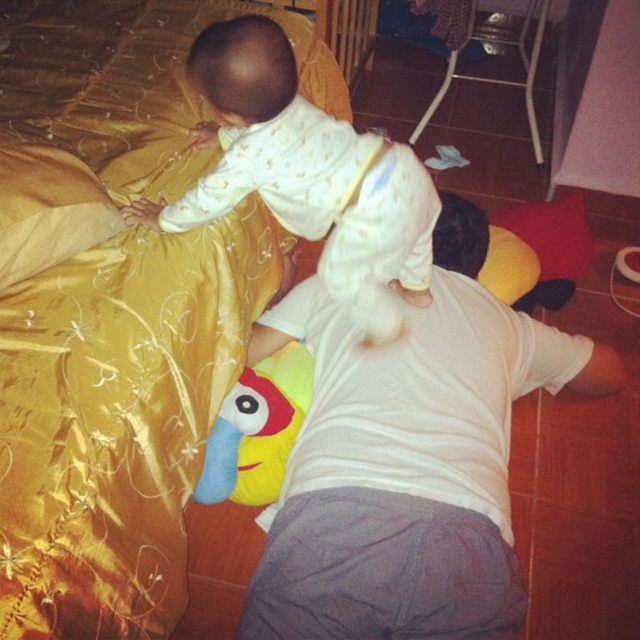
You are a photographer setting up a shot in this room. You want to place a small prop between the white soft onesie at upper center and the gold satin pillow at upper left. Based on their positions, which object should the prop be closer to?

The prop should be placed closer to the gold satin pillow at upper left because the white soft onesie at upper center is closer to the viewer, meaning the gold satin pillow at upper left is farther away. To position the prop between them, it needs to be closer to the farther object.

You are a photographer setting up a shoot in this room. You need to place a small lamp between the gold satin bed at upper left and the gold satin pillow at upper left. Based on their positions, which object should the lamp be closer to?

The gold satin bed at upper left is to the right of the gold satin pillow at upper left, so the lamp should be placed closer to the gold satin pillow at upper left to be between them.